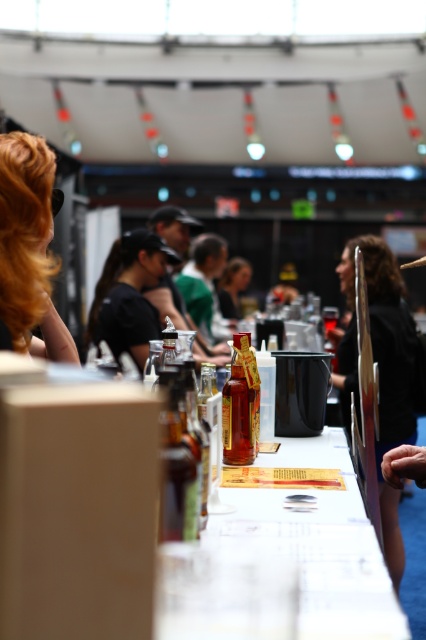
Question: Does blonde hair at upper left have a greater width compared to translucent glass bottle at center?

Choices:
 (A) yes
 (B) no

Answer: (A)

Question: Considering the real-world distances, which object is closest to the black fabric shirt at right?

Choices:
 (A) translucent glass bottle at center
 (B) blonde hair at upper left

Answer: (B)

Question: From the image, what is the correct spatial relationship of gold metallic bottle at center in relation to translucent glass bottle at center?

Choices:
 (A) right
 (B) left

Answer: (A)

Question: Which point is closer to the camera?

Choices:
 (A) translucent glass bottle at center
 (B) white paper at center

Answer: (B)

Question: Which point is farther to the camera?

Choices:
 (A) (388, 256)
 (B) (221, 531)

Answer: (A)

Question: Is the position of white paper at center more distant than that of matte black hair at center?

Choices:
 (A) yes
 (B) no

Answer: (B)